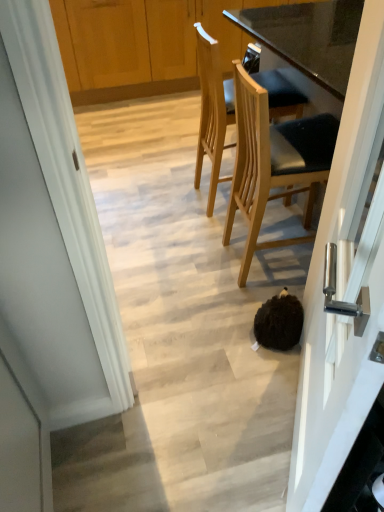
This screenshot has width=384, height=512. Find the location of `vacant space to the left of light brown wood chair at center, which ranks as the 2th chair in back-to-front order`. vacant space to the left of light brown wood chair at center, which ranks as the 2th chair in back-to-front order is located at coordinates (200, 258).